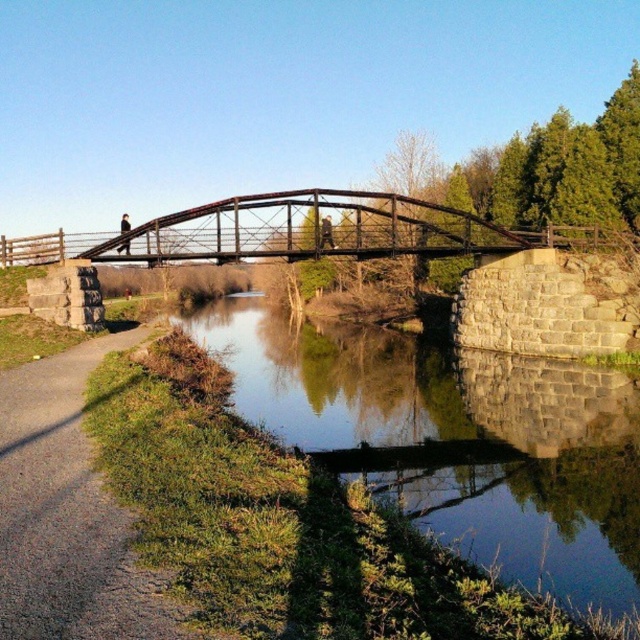
Question: Is smooth concrete water at center bigger than gravel path at lower left?

Choices:
 (A) no
 (B) yes

Answer: (B)

Question: Among these points, which one is nearest to the camera?

Choices:
 (A) (483, 506)
 (B) (68, 589)

Answer: (B)

Question: Does smooth concrete water at center appear under gravel path at lower left?

Choices:
 (A) yes
 (B) no

Answer: (A)

Question: Can you confirm if smooth concrete water at center is smaller than gravel path at lower left?

Choices:
 (A) no
 (B) yes

Answer: (A)